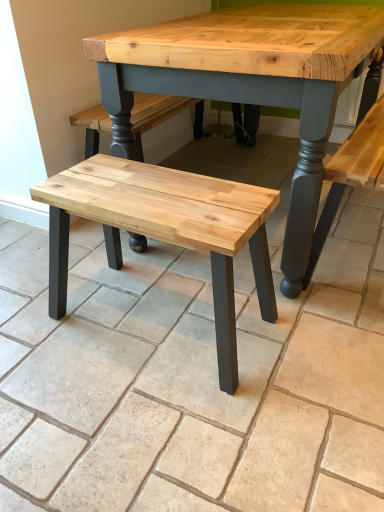
Where is `natural wood bench at center`? natural wood bench at center is located at coordinates (192, 378).

Describe the element at coordinates (192, 378) in the screenshot. I see `natural wood bench at center` at that location.

You are a GUI agent. You are given a task and a screenshot of the screen. Output one action in this format:
    pyautogui.click(x=<x>, y=<y>)
    Task: Click on the natural wood stool at center
    
    Given the screenshot: What is the action you would take?
    pyautogui.click(x=166, y=230)

What do you see at coordinates (166, 230) in the screenshot? Image resolution: width=384 pixels, height=512 pixels. I see `natural wood stool at center` at bounding box center [166, 230].

Where is `natural wood bench at center`? natural wood bench at center is located at coordinates (192, 378).

Which object is positioned more to the right, natural wood stool at center or natural wood bench at center?

Positioned to the right is natural wood bench at center.

Considering their positions, is natural wood stool at center located in front of or behind natural wood bench at center?

natural wood stool at center is behind natural wood bench at center.

Considering the points (174, 183) and (171, 421), which point is in front, point (174, 183) or point (171, 421)?

The point (171, 421) is closer to the camera.

From the image's perspective, which one is positioned higher, natural wood stool at center or natural wood bench at center?

natural wood bench at center.

From a real-world perspective, which is physically below, natural wood stool at center or natural wood bench at center?

natural wood bench at center.

In terms of width, does natural wood stool at center look wider or thinner when compared to natural wood bench at center?

In the image, natural wood stool at center appears to be more narrow than natural wood bench at center.

In terms of height, does natural wood stool at center look taller or shorter compared to natural wood bench at center?

natural wood stool at center is taller than natural wood bench at center.

Who is bigger, natural wood stool at center or natural wood bench at center?

With larger size is natural wood bench at center.

Based on the photo, is natural wood stool at center completely or partially outside of natural wood bench at center?

That's correct, natural wood stool at center is outside of natural wood bench at center.

Can you see natural wood stool at center touching natural wood bench at center?

natural wood stool at center and natural wood bench at center are not in contact.

Does natural wood stool at center turn towards natural wood bench at center?

No, natural wood stool at center is not aimed at natural wood bench at center.

How different are the orientations of natural wood stool at center and natural wood bench at center in degrees?

90.5 degrees.

You are a GUI agent. You are given a task and a screenshot of the screen. Output one action in this format:
    pyautogui.click(x=<x>, y=<y>)
    Task: Click on the tile above the natural wood stool at center (from the image's perspective)
    This screenshot has height=512, width=384.
    Given the screenshot: What is the action you would take?
    pyautogui.click(x=192, y=378)

Which object is positioned more to the right, natural wood bench at center or natural wood stool at center?

Positioned to the right is natural wood bench at center.

From the picture: Does natural wood bench at center lie in front of natural wood stool at center?

Yes.

Considering the positions of point (107, 331) and point (271, 288), is point (107, 331) closer or farther from the camera than point (271, 288)?

Point (107, 331) is positioned farther from the camera compared to point (271, 288).

From the image's perspective, is natural wood bench at center under natural wood stool at center?

No.

From a real-world perspective, is natural wood bench at center located beneath natural wood stool at center?

Yes, from a real-world perspective, natural wood bench at center is beneath natural wood stool at center.

Considering the sizes of objects natural wood bench at center and natural wood stool at center in the image provided, who is thinner, natural wood bench at center or natural wood stool at center?

Thinner between the two is natural wood stool at center.

Can you confirm if natural wood bench at center is taller than natural wood stool at center?

Incorrect, the height of natural wood bench at center is not larger of that of natural wood stool at center.

In the scene shown: Considering the sizes of natural wood bench at center and natural wood stool at center in the image, is natural wood bench at center bigger or smaller than natural wood stool at center?

natural wood bench at center is bigger than natural wood stool at center.

Is natural wood bench at center inside or outside of natural wood stool at center?

natural wood bench at center is not inside natural wood stool at center, it's outside.

Is natural wood bench at center beside natural wood stool at center?

natural wood bench at center and natural wood stool at center are clearly separated.

Is natural wood bench at center aimed at natural wood stool at center?

No, natural wood bench at center is not facing towards natural wood stool at center.

You are a GUI agent. You are given a task and a screenshot of the screen. Output one action in this format:
    pyautogui.click(x=<x>, y=<y>)
    Task: Click on the stool located above the natural wood bench at center (from a real-world perspective)
    The height and width of the screenshot is (512, 384).
    Given the screenshot: What is the action you would take?
    pyautogui.click(x=166, y=230)

Where is `stool below the natural wood bench at center (from the image's perspective)`? stool below the natural wood bench at center (from the image's perspective) is located at coordinates (166, 230).

Where is `stool that appears above the natural wood bench at center (from a real-world perspective)`? The width and height of the screenshot is (384, 512). stool that appears above the natural wood bench at center (from a real-world perspective) is located at coordinates (166, 230).